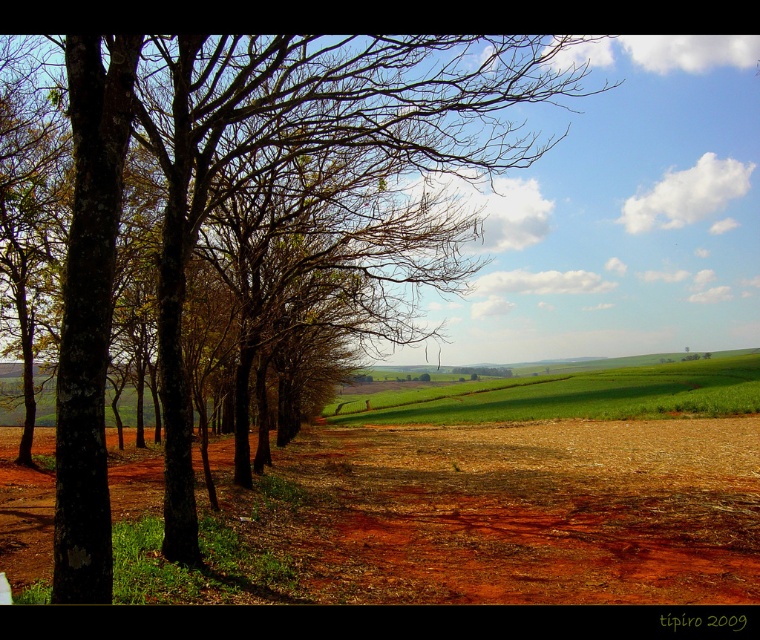
You are standing in the middle of the scene and want to walk towards the horizon. Which object, the brown rough tree at left or the brown dirt field at center, will you pass first?

The brown rough tree at left is closer to the viewer than the brown dirt field at center, so you will pass the brown rough tree at left first.